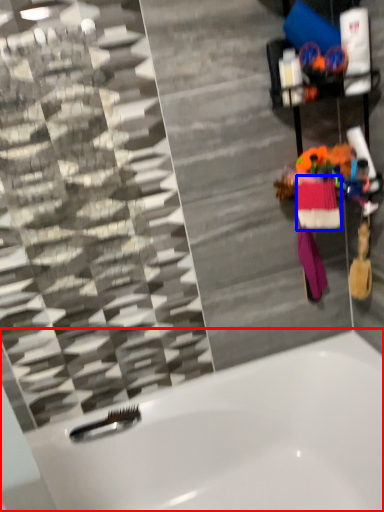
Question: Which point is closer to the camera, bathtub (highlighted by a red box) or clothing (highlighted by a blue box)?

Choices:
 (A) bathtub
 (B) clothing

Answer: (A)